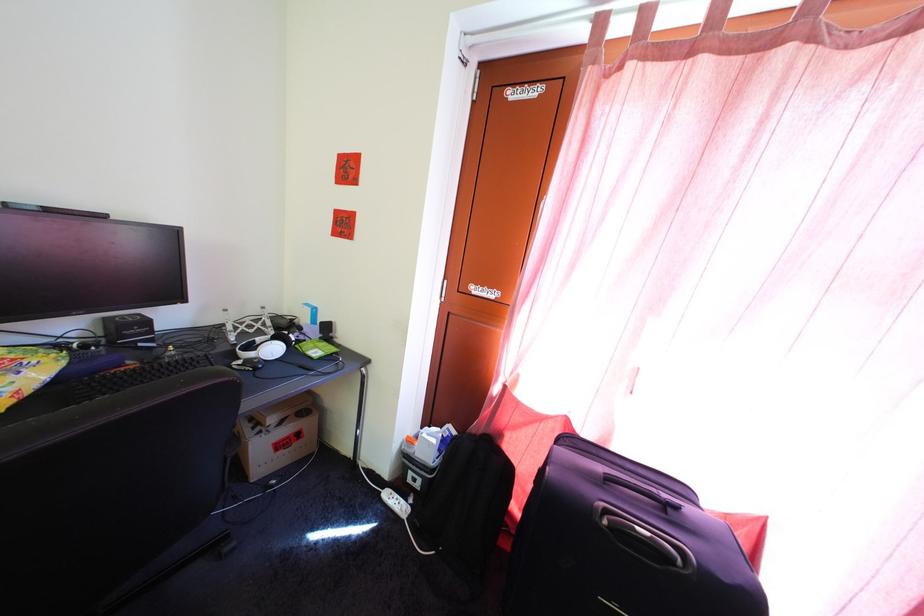
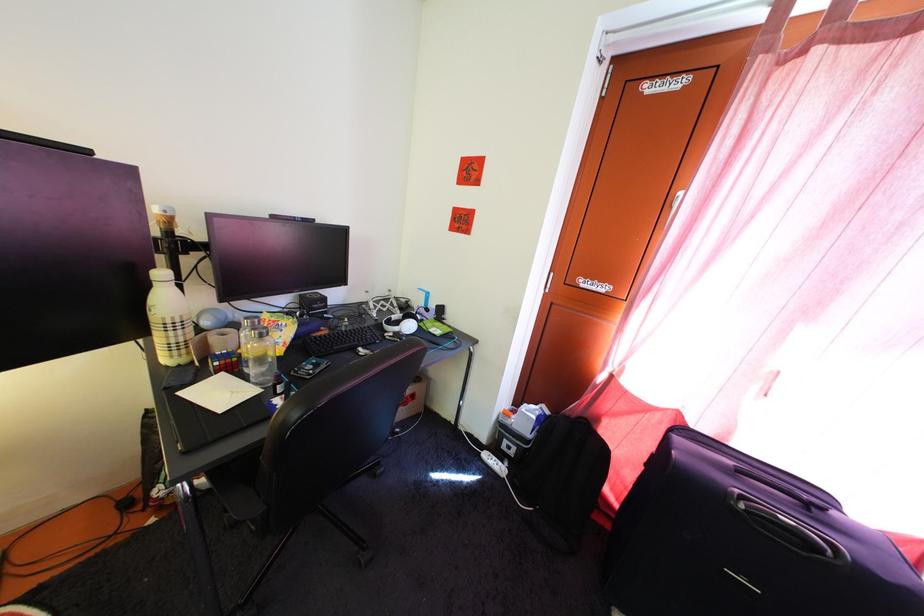
Question: Based on the continuous images, in which direction is the camera rotating? Reply with the corresponding letter.

Choices:
 (A) Left
 (B) Right
 (C) Up
 (D) Down

Answer: (A)